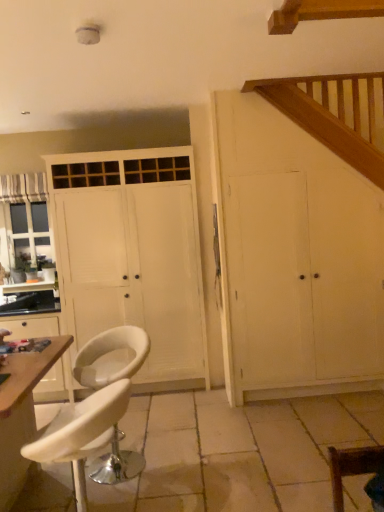
Question: In terms of height, does matte white cabinet at left look taller or shorter compared to white wood cupboard at right, the 1th cupboard viewed from the right?

Choices:
 (A) short
 (B) tall

Answer: (A)

Question: Based on their positions, is matte white cabinet at left located to the left or right of white wood cupboard at right, the 1th cupboard viewed from the right?

Choices:
 (A) left
 (B) right

Answer: (A)

Question: Based on their relative distances, which object is nearer to the matte white cabinet at left?

Choices:
 (A) striped fabric curtain at left
 (B) white wood cupboard at right, which ranks as the second cupboard in left-to-right order
 (C) white leather stool at lower left, acting as the second chair starting from the back
 (D) white leather bar stool at lower left, the third chair viewed from the front
 (E) white matte cabinet at center, the second cupboard in the right-to-left sequence

Answer: (E)

Question: Estimate the real-world distances between objects in this image. Which object is farther from the white wood cupboard at right, the 1th cupboard viewed from the right?

Choices:
 (A) white leather stool at lower left, acting as the second chair starting from the back
 (B) white leather chair at lower right, which is the 3th chair from left to right
 (C) wooden table at lower left
 (D) white matte cabinet at center, the second cupboard in the right-to-left sequence
 (E) white leather bar stool at lower left, the third chair viewed from the front

Answer: (C)